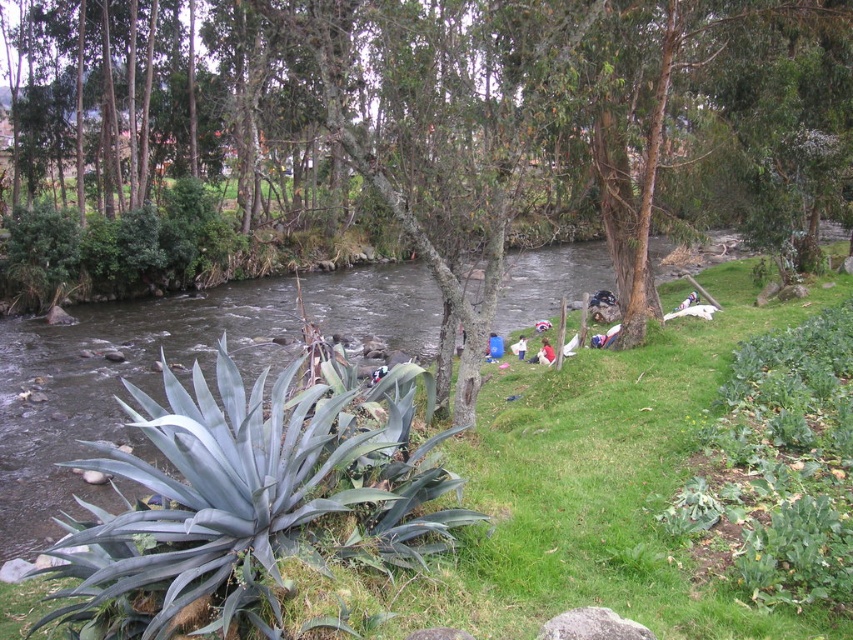
Question: Does green grass at lower left appear under white cotton shirt at lower center?

Choices:
 (A) yes
 (B) no

Answer: (B)

Question: Can you confirm if green leafy tree at center is positioned to the right of green grass at lower left?

Choices:
 (A) no
 (B) yes

Answer: (A)

Question: Which of the following is the closest to the observer?

Choices:
 (A) (477, 552)
 (B) (485, 195)

Answer: (A)

Question: Based on their relative distances, which object is farther from the white cotton shirt at lower center?

Choices:
 (A) green leafy tree at center
 (B) green grass at lower left

Answer: (A)

Question: Does green leafy tree at center appear over green grass at lower left?

Choices:
 (A) yes
 (B) no

Answer: (A)

Question: Estimate the real-world distances between objects in this image. Which object is closer to the white cotton shirt at lower center?

Choices:
 (A) green leafy tree at center
 (B) green grass at lower left

Answer: (B)